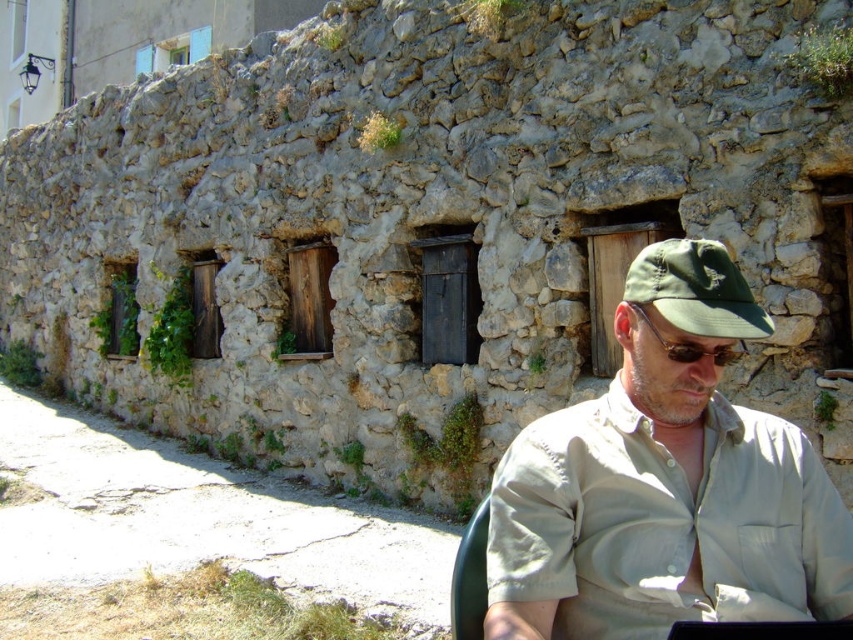
You are a photographer taking a portrait of the man in the scene. You want to ensure both the khaki cotton shirt at center and the green fabric cap at center are clearly visible. Which object should you position closer to the camera to keep both in focus?

You should position the green fabric cap at center closer to the camera because the khaki cotton shirt at center is to the right of the green fabric cap at center, so adjusting the cap to be nearer ensures both remain in focus.